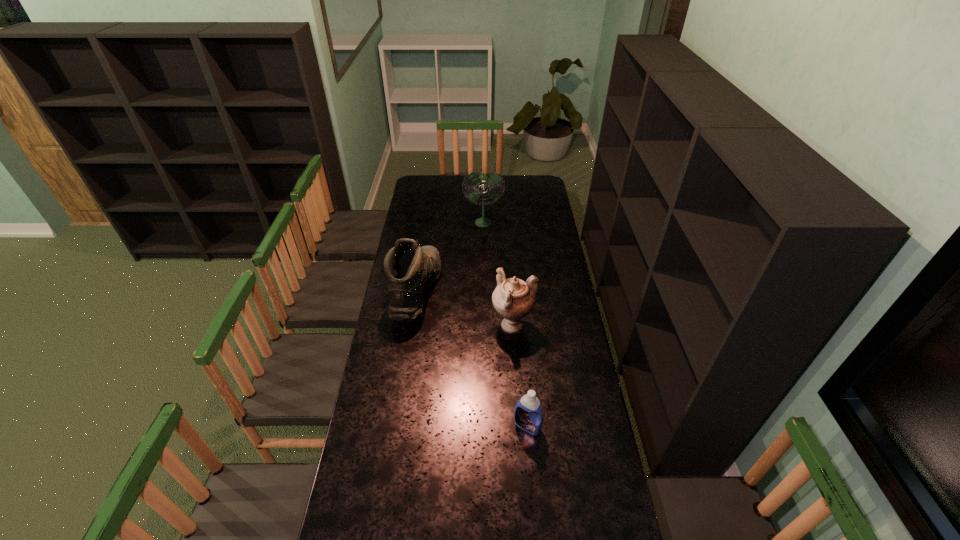
At what (x,y) coordinates should I click in order to perform the action: click on free spot that satisfies the following two spatial constraints: 1. on the front-facing side of the shortest object; 2. on the right side of the farthest object. Please return your answer as a coordinate pair (x, y). The image size is (960, 540). Looking at the image, I should click on (485, 426).